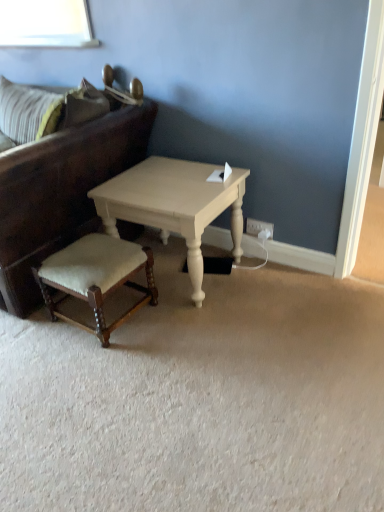
You are a GUI agent. You are given a task and a screenshot of the screen. Output one action in this format:
    pyautogui.click(x=<x>, y=<y>)
    Task: Click on the vacant region under velvet beige stool at lower left (from a real-world perspective)
    The image size is (384, 512).
    Given the screenshot: What is the action you would take?
    pyautogui.click(x=115, y=313)